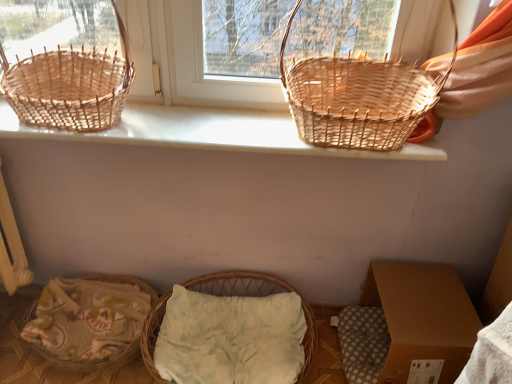
Question: Is point (74, 339) closer or farther from the camera than point (26, 97)?

Choices:
 (A) closer
 (B) farther

Answer: (B)

Question: In the image, is natural wicker basket at lower left positioned in front of or behind woven natural basket at left, which is the 1th picnic basket in left-to-right order?

Choices:
 (A) behind
 (B) front

Answer: (A)

Question: Which of these objects is positioned farthest from the woven wicker basket at center, placed as the 3th picnic basket when sorted from top to bottom?

Choices:
 (A) brown cardboard box at lower right
 (B) natural wicker basket at lower left
 (C) woven natural basket at left, marked as the 3th picnic basket in a right-to-left arrangement
 (D) woven natural basket at upper right, the 2th picnic basket in the bottom-to-top sequence
 (E) woven wood baskets at upper center

Answer: (C)

Question: Which object is positioned closest to the brown cardboard box at lower right?

Choices:
 (A) natural wicker basket at lower left
 (B) woven natural basket at upper right, the 2th picnic basket in the bottom-to-top sequence
 (C) woven natural basket at left, which is the 1th picnic basket in left-to-right order
 (D) woven wood baskets at upper center
 (E) woven wicker basket at center, placed as the second picnic basket when sorted from left to right

Answer: (E)